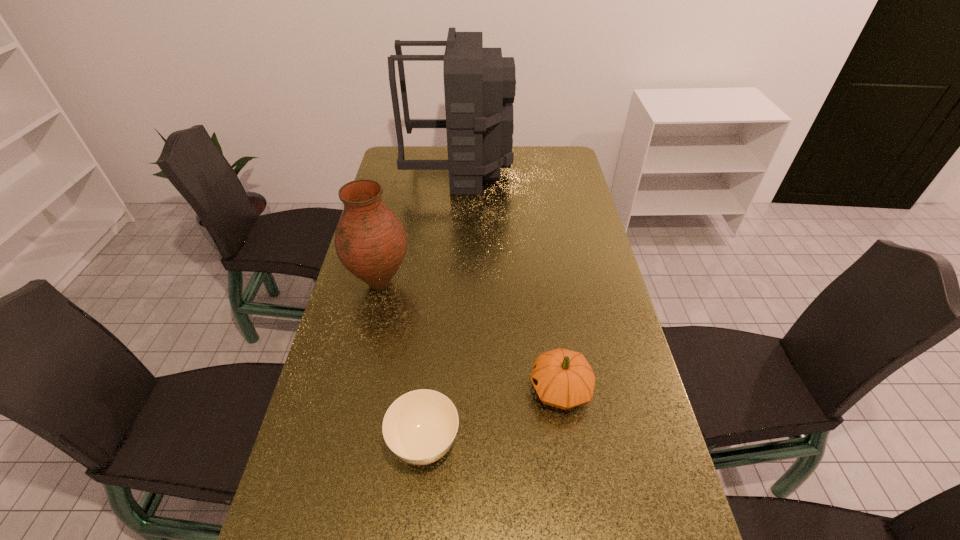
Find the location of `vacant space located on the side of the third tallest object with the carved face`. vacant space located on the side of the third tallest object with the carved face is located at coordinates (477, 389).

Image resolution: width=960 pixels, height=540 pixels. Identify the location of vacant area located on the left of the shortest object. (346, 444).

Image resolution: width=960 pixels, height=540 pixels. I want to click on object that is at the far edge, so click(x=479, y=84).

You are a GUI agent. You are given a task and a screenshot of the screen. Output one action in this format:
    pyautogui.click(x=<x>, y=<y>)
    Task: Click on the backpack present at the left edge
    This screenshot has height=540, width=960.
    Given the screenshot: What is the action you would take?
    pyautogui.click(x=479, y=84)

Locate an element on the screen. The image size is (960, 540). vase that is at the left edge is located at coordinates (370, 241).

The image size is (960, 540). Identify the location of object positioned at the right edge. (562, 378).

Identify the location of object located in the far left corner section of the desktop. (479, 84).

The height and width of the screenshot is (540, 960). In order to click on vacant space at the far edge in this screenshot , I will do `click(425, 158)`.

The width and height of the screenshot is (960, 540). What are the coordinates of `free space at the left edge` in the screenshot? It's located at (363, 320).

Where is `vacant region at the right edge of the desktop`? This screenshot has width=960, height=540. vacant region at the right edge of the desktop is located at coordinates (567, 207).